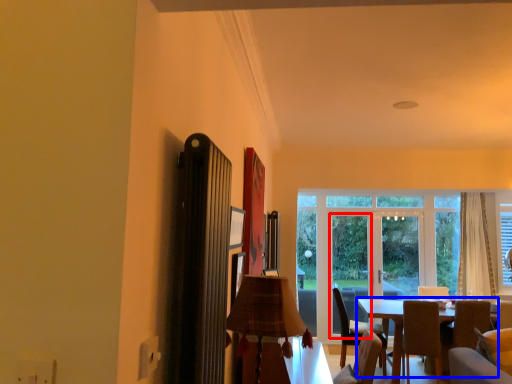
Question: Which object is further to the camera taking this photo, screen door (highlighted by a red box) or table (highlighted by a blue box)?

Choices:
 (A) screen door
 (B) table

Answer: (A)